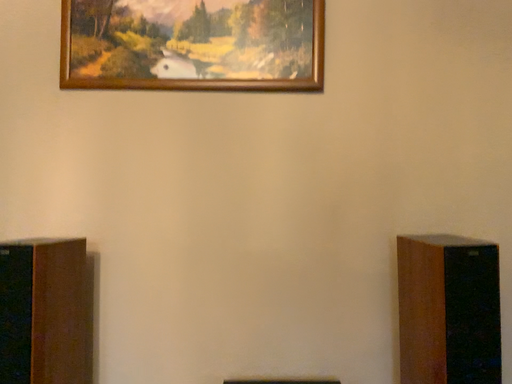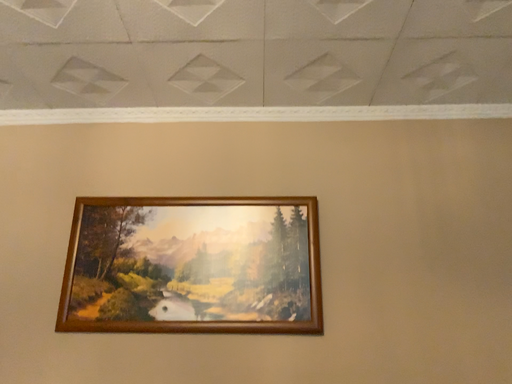
Question: How did the camera likely rotate when shooting the video?

Choices:
 (A) rotated downward
 (B) rotated upward

Answer: (B)